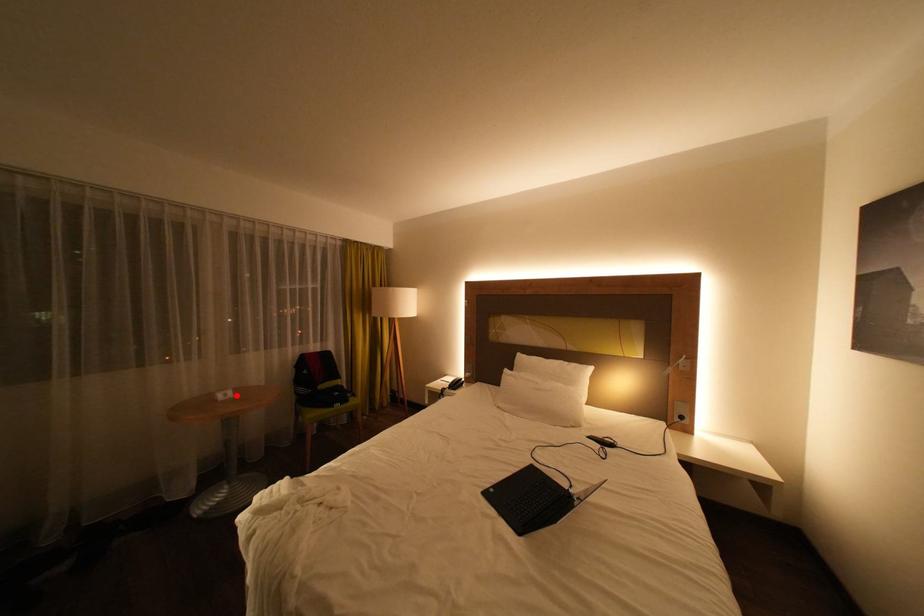
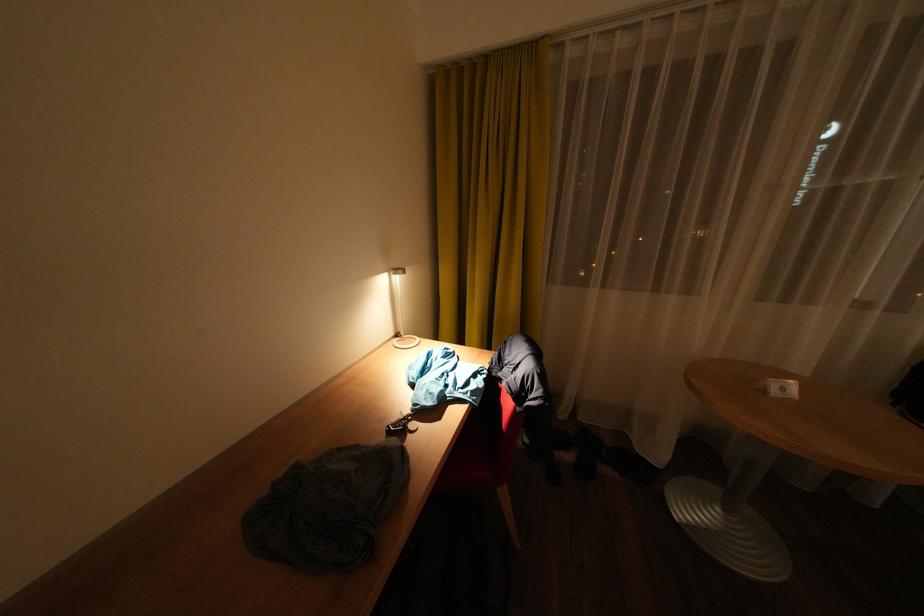
Question: I am providing you with two images of the same scene from different viewpoints. Given a red point in image1, look at the same physical point in image2. Is it:

Choices:
 (A) Closer to the viewpoint
 (B) Farther from the viewpoint

Answer: (B)